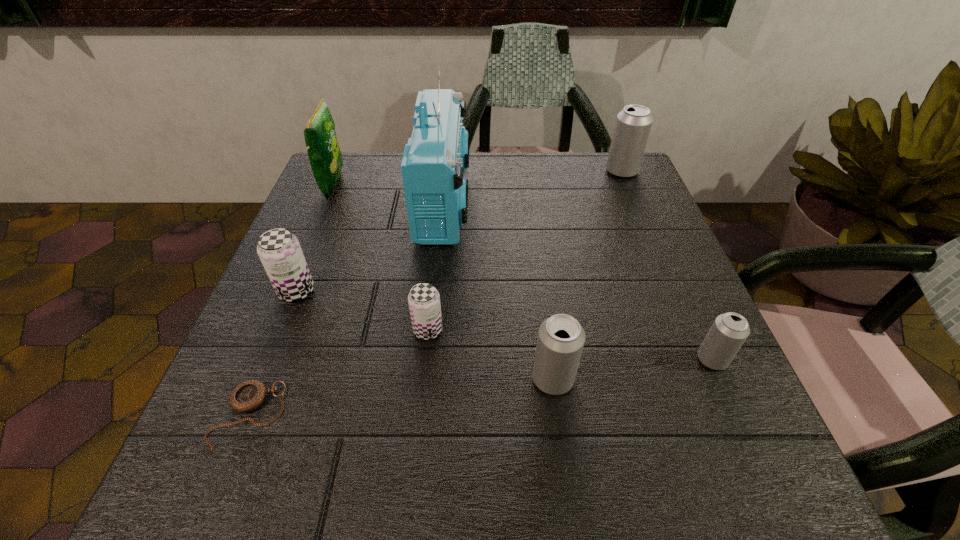
The width and height of the screenshot is (960, 540). In order to click on free region located 0.250m on the back of the shortest object in this screenshot , I will do `click(305, 274)`.

At what (x,y) coordinates should I click in order to perform the action: click on radio receiver positioned at the far edge. Please return your answer as a coordinate pair (x, y). Image resolution: width=960 pixels, height=540 pixels. Looking at the image, I should click on (435, 157).

Identify the location of crisp (potato chip) that is at the far edge. (325, 157).

Find the location of a particular element. beer can at the far edge is located at coordinates (633, 124).

Where is `object positioned at the near edge`? Image resolution: width=960 pixels, height=540 pixels. object positioned at the near edge is located at coordinates (249, 395).

Where is `crisp (potato chip) that is at the left edge`? crisp (potato chip) that is at the left edge is located at coordinates (325, 157).

Locate an element on the screen. The height and width of the screenshot is (540, 960). beer can situated at the left edge is located at coordinates (279, 250).

Image resolution: width=960 pixels, height=540 pixels. Identify the location of pocket watch at the left edge. (249, 395).

Locate an element on the screen. object that is at the far left corner is located at coordinates (325, 157).

The height and width of the screenshot is (540, 960). I want to click on object that is at the near left corner, so click(x=249, y=395).